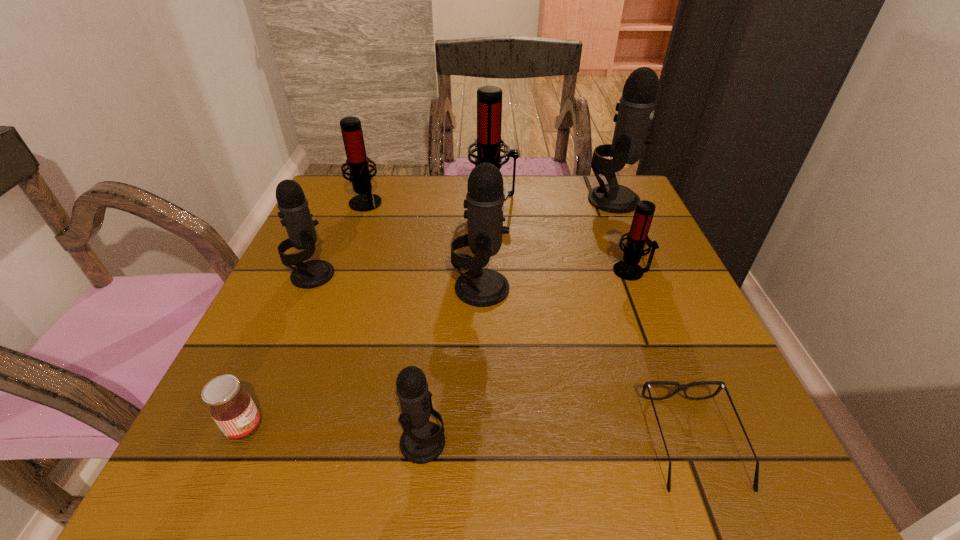
Where is `the second shortest object`? Image resolution: width=960 pixels, height=540 pixels. the second shortest object is located at coordinates (231, 407).

What are the coordinates of `spectacles` in the screenshot? It's located at (681, 387).

At what (x,y) coordinates should I click in order to perform the action: click on free location located 0.320m on the front of the biggest black microphone. Please return your answer as a coordinate pair (x, y). This screenshot has height=540, width=960. Looking at the image, I should click on (658, 305).

Identify the location of vacant space located 0.240m on the front of the biggest red microphone. The image size is (960, 540). (495, 265).

Locate an element on the screen. free space located on the front of the third smallest black microphone is located at coordinates (481, 480).

You are a GUI agent. You are given a task and a screenshot of the screen. Output one action in this format:
    pyautogui.click(x=<x>, y=<y>)
    Task: Click on the free space located on the right of the leftmost red microphone
    
    Given the screenshot: What is the action you would take?
    point(452,201)

Locate an element on the screen. Image resolution: width=960 pixels, height=540 pixels. vacant space located on the front of the third biggest black microphone is located at coordinates (284, 338).

Image resolution: width=960 pixels, height=540 pixels. I want to click on vacant area situated on the front of the rightmost red microphone, so click(646, 308).

Where is `vacant space located 0.090m on the left of the smallest black microphone`? vacant space located 0.090m on the left of the smallest black microphone is located at coordinates (337, 442).

This screenshot has width=960, height=540. Identify the location of free space located on the label side of the jam. (404, 427).